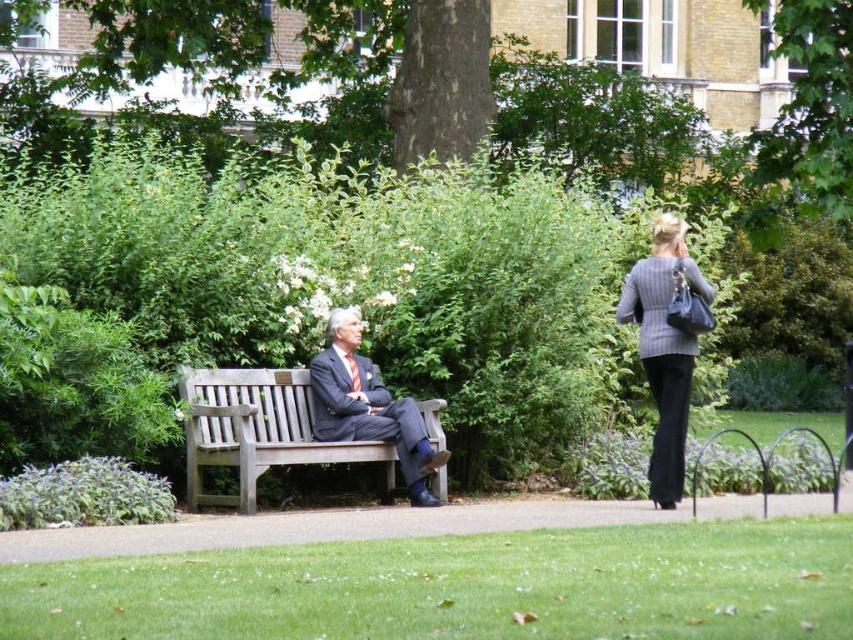
You are standing in the park and want to take a photo of the green leafy tree at upper right. If your camera has a maximum zoom range of 50 meters, will you be able to capture the tree clearly without moving closer?

The green leafy tree at upper right is 40.39 meters away from the viewer. Since the camera can zoom up to 50 meters, you can capture the tree clearly without moving closer.